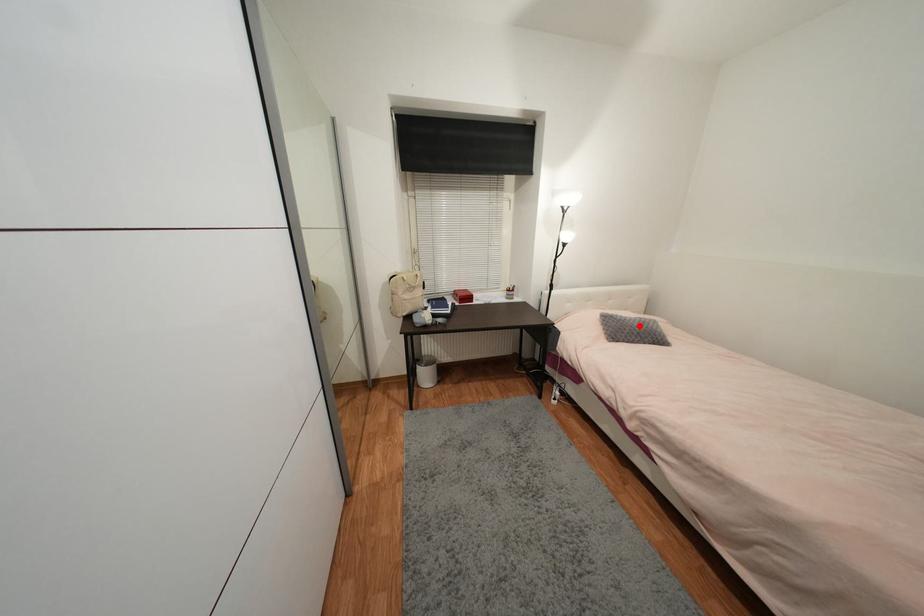
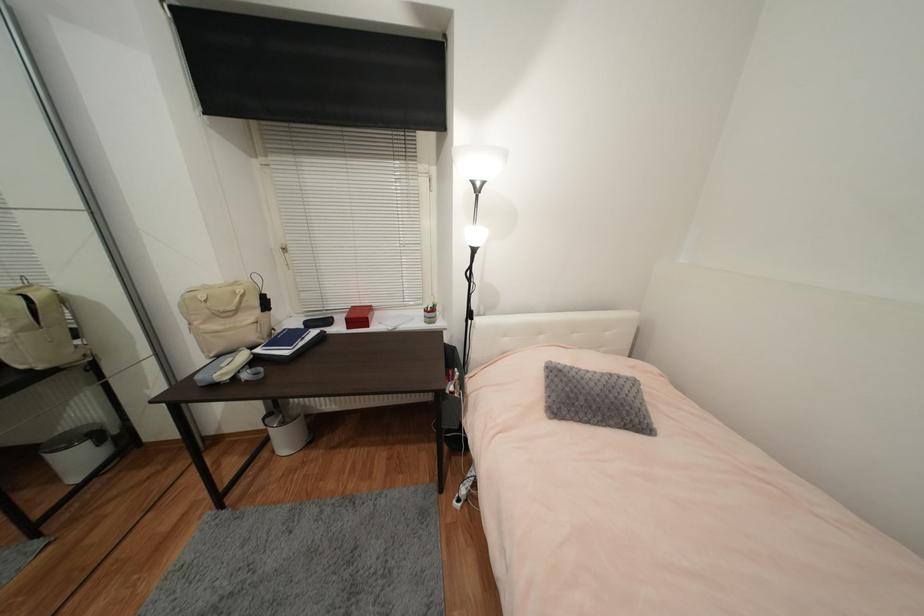
Locate, in the second image, the point that corresponds to the highlighted location in the first image.

(602, 391)